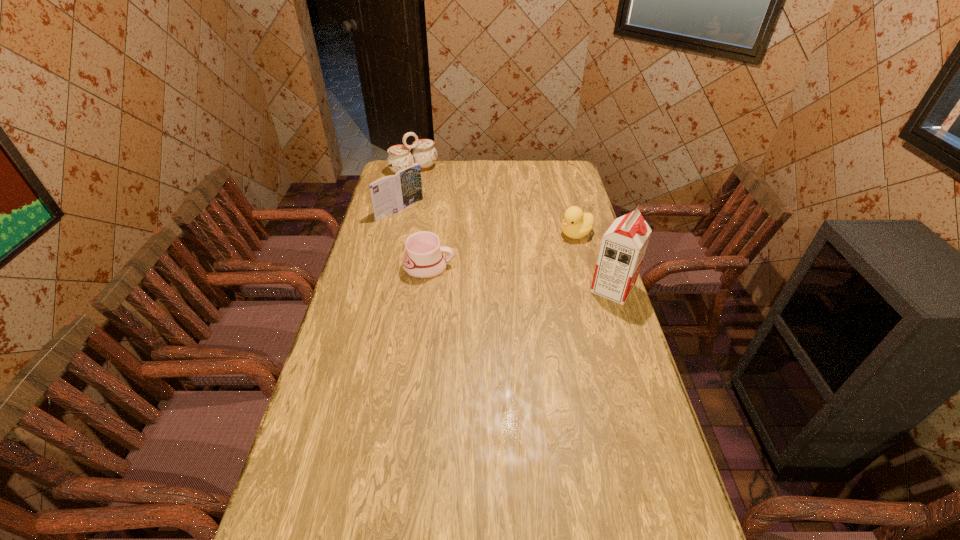
Find the location of a particular element. free space on the desktop that is between the shortest object and the soya milk and is positioned on the front-facing side of the third nearest object is located at coordinates (497, 275).

Locate an element on the screen. The image size is (960, 540). free space on the desktop that is between the mug and the tallest object and is positioned on the front cover of the book is located at coordinates (497, 275).

At what (x,y) coordinates should I click in order to perform the action: click on vacant space on the desktop that is between the shortest object and the soya milk and is positioned by the handle of the chinaware. Please return your answer as a coordinate pair (x, y). Looking at the image, I should click on (516, 277).